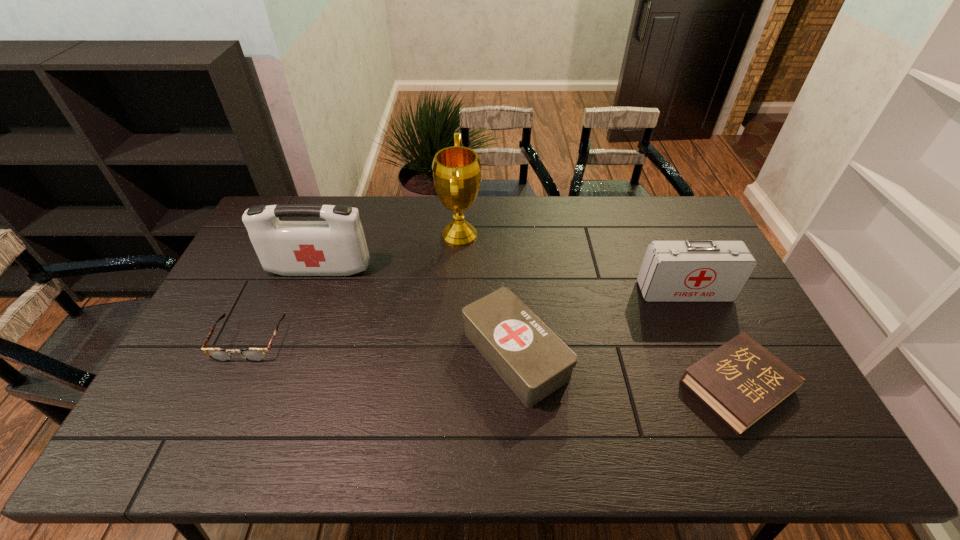
At what (x,y) coordinates should I click in order to perform the action: click on free space that satisfies the following two spatial constraints: 1. on the front-facing side of the fourth nearest object; 2. on the left side of the hardback book. Please return your answer as a coordinate pair (x, y). Looking at the image, I should click on click(x=727, y=386).

Image resolution: width=960 pixels, height=540 pixels. What are the coordinates of `vacant space that satisfies the following two spatial constraints: 1. on the front side of the farthest first-aid kit; 2. on the right side of the fourth tallest object` in the screenshot? It's located at (288, 354).

Locate an element on the screen. This screenshot has width=960, height=540. free space that satisfies the following two spatial constraints: 1. on the front-facing side of the award; 2. on the front side of the second tallest object is located at coordinates (458, 269).

Identify the location of free location that satisfies the following two spatial constraints: 1. on the front side of the second first-aid kit from left to right; 2. on the right side of the farthest first-aid kit. point(288,354).

This screenshot has height=540, width=960. In order to click on free spot that satisfies the following two spatial constraints: 1. on the front-facing side of the tallest object; 2. on the back side of the shortest first-aid kit in this screenshot , I will do `click(453, 354)`.

Locate an element on the screen. This screenshot has width=960, height=540. vacant position in the image that satisfies the following two spatial constraints: 1. on the frame of the hardback book; 2. on the right side of the spectacles is located at coordinates (229, 386).

Where is `vacant region that satisfies the following two spatial constraints: 1. on the front-facing side of the hardback book; 2. on the left side of the third tallest object`? The image size is (960, 540). vacant region that satisfies the following two spatial constraints: 1. on the front-facing side of the hardback book; 2. on the left side of the third tallest object is located at coordinates (727, 386).

Locate an element on the screen. Image resolution: width=960 pixels, height=540 pixels. vacant space that satisfies the following two spatial constraints: 1. on the front-facing side of the tallest object; 2. on the front side of the leftmost first-aid kit is located at coordinates (458, 269).